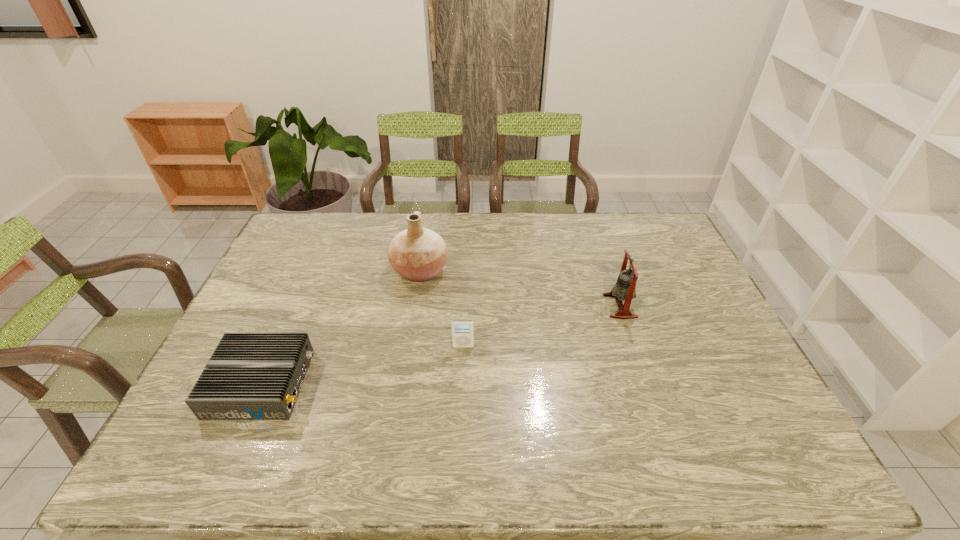
Locate an element on the screen. vacant space that satisfies the following two spatial constraints: 1. to pour from the handle of the pottery; 2. on the back side of the third nearest object is located at coordinates (414, 306).

Find the location of a particular element. The image size is (960, 540). free location that satisfies the following two spatial constraints: 1. to pour from the handle of the farthest object; 2. on the left side of the rightmost object is located at coordinates (414, 306).

Locate an element on the screen. This screenshot has width=960, height=540. vacant area that satisfies the following two spatial constraints: 1. to pour from the handle of the rightmost object; 2. on the left side of the farthest object is located at coordinates (414, 306).

Find the location of a particular element. The width and height of the screenshot is (960, 540). free space that satisfies the following two spatial constraints: 1. to pour from the handle of the second object from left to right; 2. on the back side of the second farthest object is located at coordinates pyautogui.click(x=414, y=306).